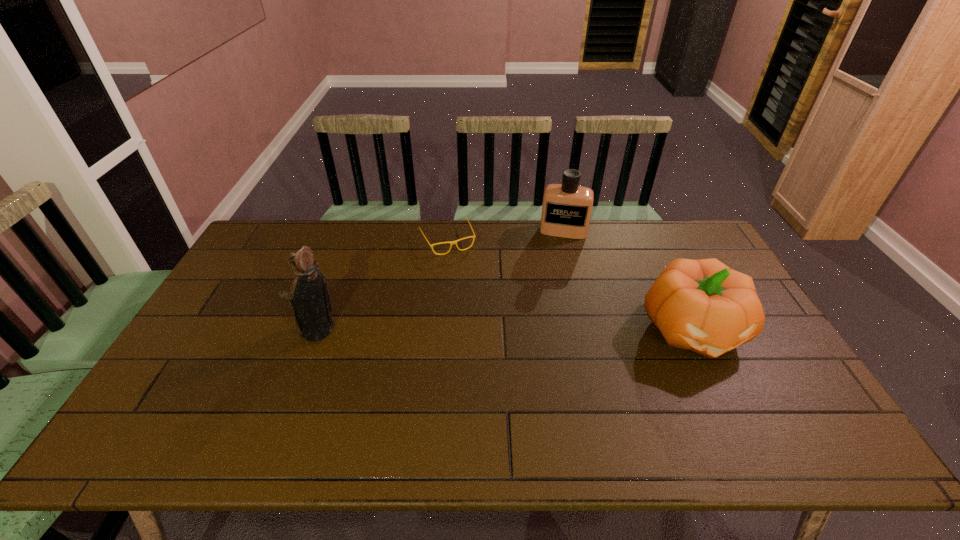
Find the location of a particular element. free location located in front of the lenses of the third object from right to left is located at coordinates (478, 300).

You are a GUI agent. You are given a task and a screenshot of the screen. Output one action in this format:
    pyautogui.click(x=<x>, y=<y>)
    Task: Click on the free space located 0.330m in front of the lenses of the third object from right to left
    
    Given the screenshot: What is the action you would take?
    pyautogui.click(x=490, y=322)

Locate an element on the screen. Image resolution: width=960 pixels, height=540 pixels. free space located in front of the lenses of the third object from right to left is located at coordinates (465, 274).

This screenshot has height=540, width=960. Find the location of `vacant position located on the front label of the perfume`. vacant position located on the front label of the perfume is located at coordinates (559, 248).

The image size is (960, 540). In order to click on blank area located 0.080m on the front label of the perfume in this screenshot , I will do `click(559, 253)`.

Identify the location of vacant area located on the front label of the perfume. (558, 254).

Image resolution: width=960 pixels, height=540 pixels. Find the location of `spectacles that is at the far edge`. spectacles that is at the far edge is located at coordinates (451, 242).

In order to click on perfume situated at the far edge in this screenshot , I will do `click(566, 210)`.

This screenshot has height=540, width=960. I want to click on object positioned at the right edge, so click(x=703, y=305).

I want to click on vacant space at the far edge, so click(x=370, y=230).